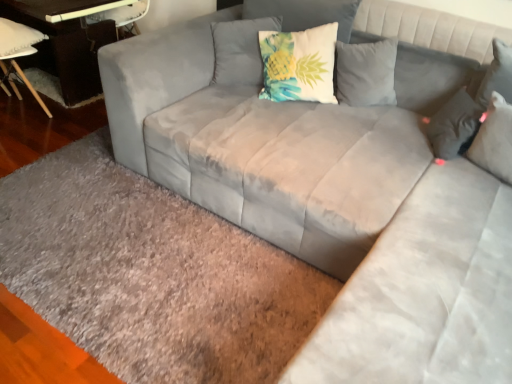
Question: Is gray shaggy rug at lower left in front of or behind teal fabric pillow at upper center, the first pillow positioned from the left, in the image?

Choices:
 (A) behind
 (B) front

Answer: (B)

Question: From the image's perspective, relative to teal fabric pillow at upper center, the first pillow positioned from the left, is gray shaggy rug at lower left above or below?

Choices:
 (A) above
 (B) below

Answer: (B)

Question: Which is farther from the white fabric pillow with pineapple print at upper center, which appears as the second pillow when viewed from the left?

Choices:
 (A) suede gray pillow at upper right, marked as the 3th pillow in a left-to-right arrangement
 (B) teal fabric pillow at upper center, acting as the third pillow starting from the right
 (C) gray shaggy rug at lower left
 (D) white fabric chair at lower left
 (E) dark brown wood table at left

Answer: (D)

Question: Estimate the real-world distances between objects in this image. Which object is farther from the dark brown wood table at left?

Choices:
 (A) white fabric pillow with pineapple print at upper center, the 2th pillow from the right
 (B) white fabric chair at lower left
 (C) suede gray pillow at upper right, which is the first pillow from right to left
 (D) teal fabric pillow at upper center, the first pillow positioned from the left
 (E) gray shaggy rug at lower left

Answer: (C)